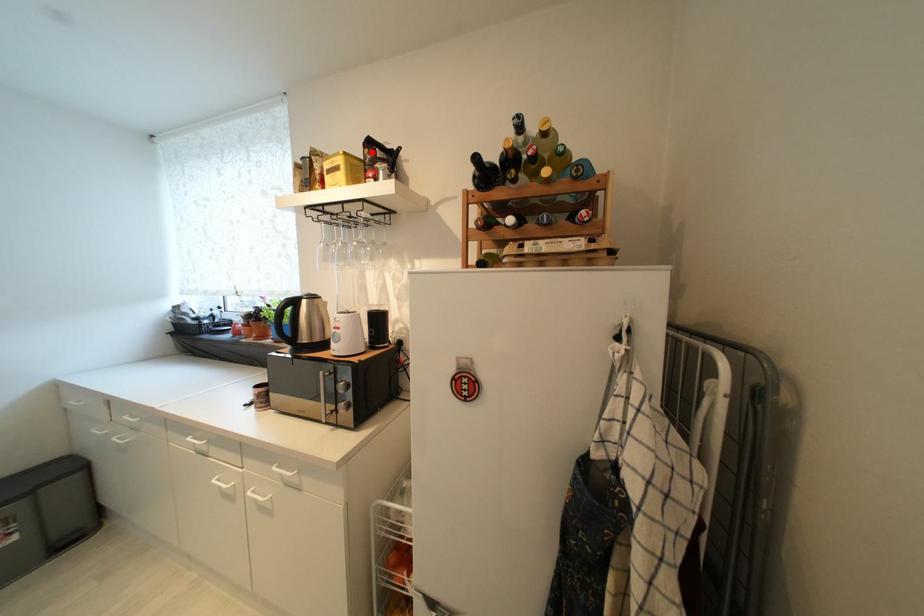
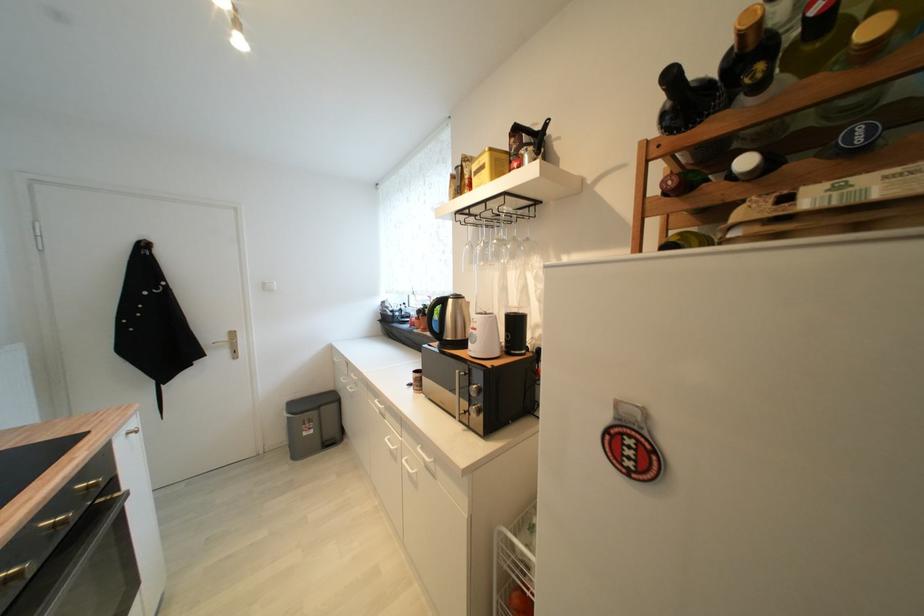
Question: I am providing you with two images of the same scene from different viewpoints. A red point is marked on the first image. At the location where the point appears in image 1, is it still visible in image 2?

Choices:
 (A) Yes
 (B) No

Answer: (A)